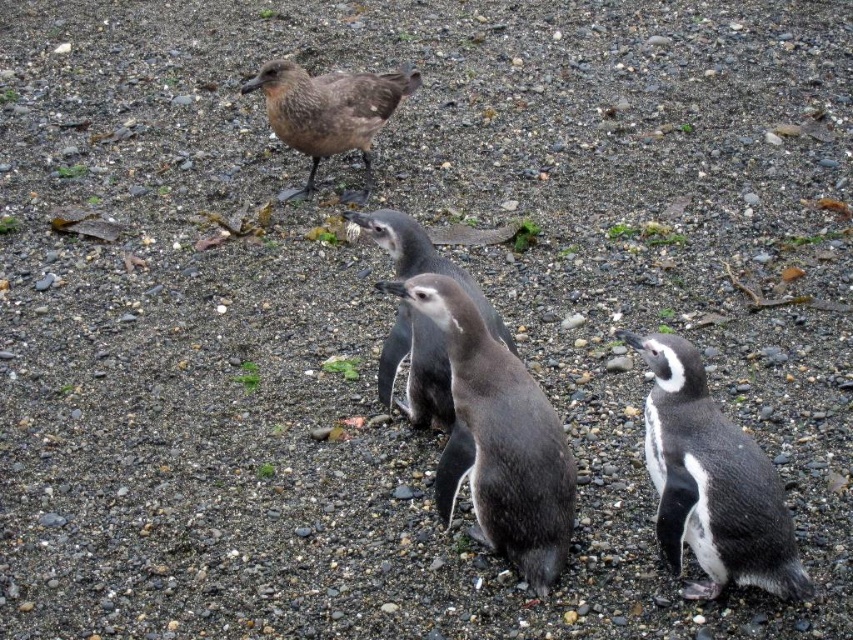
You are a wildlife photographer trying to capture a closeup of the gray matte penguin at lower right and the black glossy penguin at center. Based on their sizes, which penguin would require you to use a wider angle lens to fit into the frame?

The gray matte penguin at lower right is bigger than the black glossy penguin at center, so you would need to use a wider angle lens to capture the gray matte penguin at lower right in its entirety.

You are a photographer trying to capture a photo of the black glossy penguin at center and the brown feathered bird at upper center. Based on their positions, which one is positioned to the right side of the other?

The black glossy penguin at center is positioned to the right of the brown feathered bird at upper center.